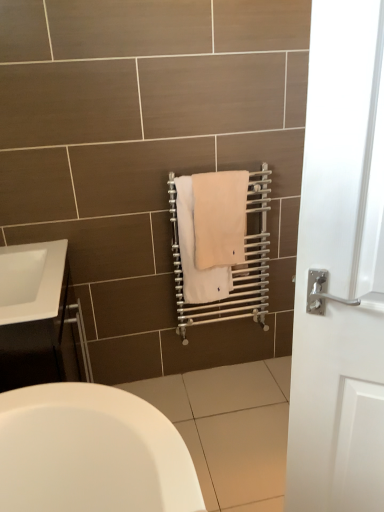
Question: In terms of width, does white glossy cabinet at left look wider or thinner when compared to beige cotton towel at center, placed as the 1th bath towel when sorted from left to right?

Choices:
 (A) thin
 (B) wide

Answer: (B)

Question: From the image's perspective, relative to beige cotton towel at center, the 2th bath towel viewed from the right, is white glossy cabinet at left above or below?

Choices:
 (A) below
 (B) above

Answer: (A)

Question: Estimate the real-world distances between objects in this image. Which object is closer to the white glossy sink at lower left?

Choices:
 (A) beige cotton towel at center, the 2th bath towel viewed from the right
 (B) white glossy cabinet at left
 (C) silver metallic towel rack at center
 (D) beige cotton towel at center, positioned as the 1th bath towel in right-to-left order

Answer: (B)

Question: Estimate the real-world distances between objects in this image. Which object is closer to the beige cotton towel at center, the 2th bath towel viewed from the right?

Choices:
 (A) white glossy sink at lower left
 (B) beige cotton towel at center, positioned as the 1th bath towel in right-to-left order
 (C) white glossy cabinet at left
 (D) silver metallic towel rack at center

Answer: (B)